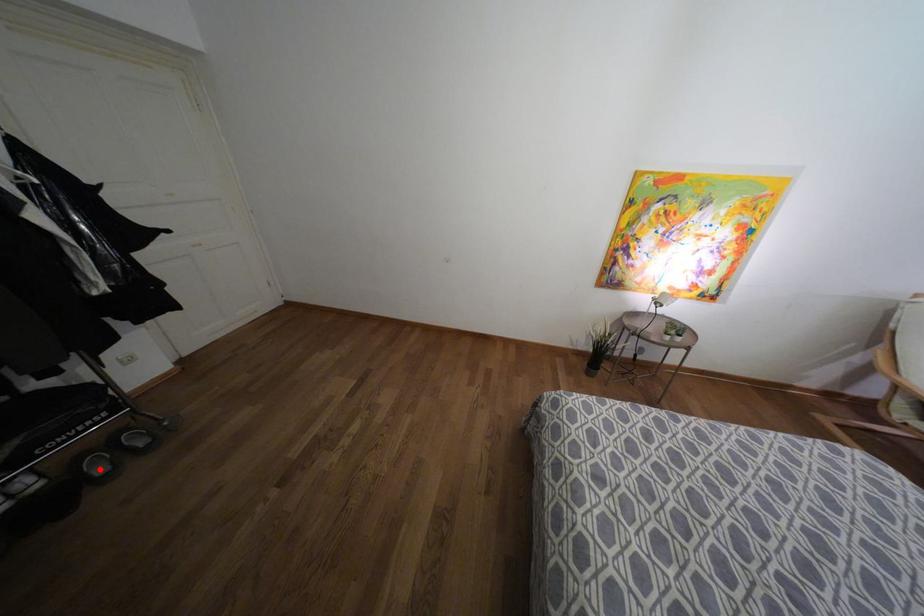
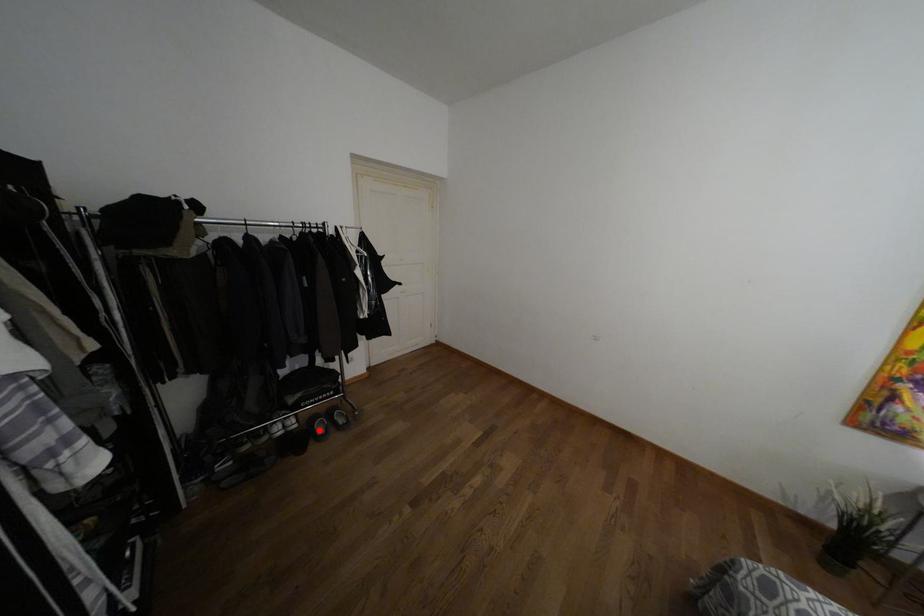
I am providing you with two images of the same scene from different viewpoints. A red point is marked on the first image and another point is marked on the second image. Is the marked point in image1 the same physical position as the marked point in image2?

Yes